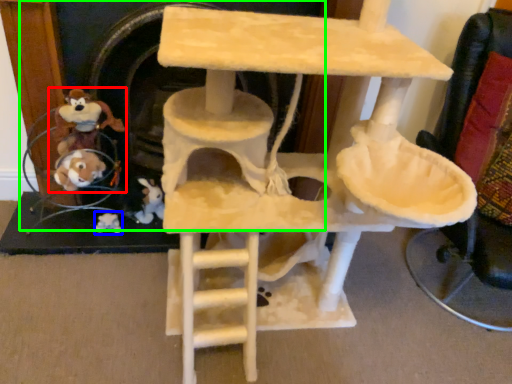
Question: Based on their relative distances, which object is nearer to toy (highlighted by a red box)? Choose from toy (highlighted by a blue box) and fireplace (highlighted by a green box).

Choices:
 (A) toy
 (B) fireplace

Answer: (B)